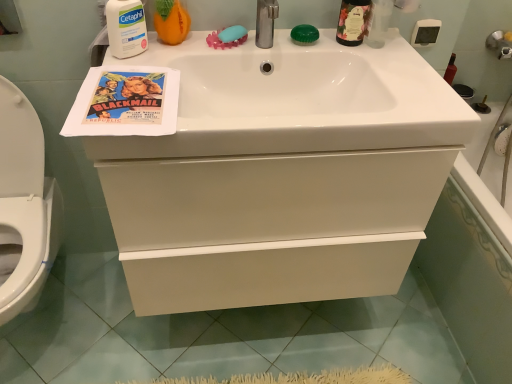
Question: Does green glass bottle at upper right have a larger size compared to white glossy sink at upper center?

Choices:
 (A) no
 (B) yes

Answer: (A)

Question: Are green glass bottle at upper right and white glossy sink at upper center making contact?

Choices:
 (A) no
 (B) yes

Answer: (A)

Question: Does green glass bottle at upper right have a smaller size compared to white glossy sink at upper center?

Choices:
 (A) yes
 (B) no

Answer: (A)

Question: Considering the relative positions of green glass bottle at upper right and white glossy sink at upper center in the image provided, is green glass bottle at upper right to the left of white glossy sink at upper center from the viewer's perspective?

Choices:
 (A) no
 (B) yes

Answer: (A)

Question: Is green glass bottle at upper right taller than white glossy sink at upper center?

Choices:
 (A) no
 (B) yes

Answer: (B)

Question: From their relative heights in the image, would you say white glossy bathtub at right is taller or shorter than white glossy cabinet at center?

Choices:
 (A) short
 (B) tall

Answer: (A)

Question: Would you say white glossy bathtub at right is inside or outside white glossy cabinet at center?

Choices:
 (A) inside
 (B) outside

Answer: (B)

Question: Considering the positions of point (479, 286) and point (359, 286), is point (479, 286) closer or farther from the camera than point (359, 286)?

Choices:
 (A) farther
 (B) closer

Answer: (B)

Question: From the image's perspective, relative to white glossy cabinet at center, is white glossy bathtub at right above or below?

Choices:
 (A) below
 (B) above

Answer: (A)

Question: Would you say white glossy bathtub at right is to the left or to the right of white glossy toilet at lower left in the picture?

Choices:
 (A) left
 (B) right

Answer: (B)

Question: Based on their sizes in the image, would you say white glossy bathtub at right is bigger or smaller than white glossy toilet at lower left?

Choices:
 (A) small
 (B) big

Answer: (B)

Question: Would you say white glossy bathtub at right is inside or outside white glossy toilet at lower left?

Choices:
 (A) outside
 (B) inside

Answer: (A)

Question: Is white glossy bathtub at right taller or shorter than white glossy toilet at lower left?

Choices:
 (A) short
 (B) tall

Answer: (A)

Question: Considering the positions of white matte cetaphil at upper left, the first cleaning product positioned from the left, and white glossy bathtub at right in the image, is white matte cetaphil at upper left, the first cleaning product positioned from the left, bigger or smaller than white glossy bathtub at right?

Choices:
 (A) big
 (B) small

Answer: (B)

Question: Is white matte cetaphil at upper left, which appears as the second cleaning product when viewed from the right, situated inside white glossy bathtub at right or outside?

Choices:
 (A) inside
 (B) outside

Answer: (B)